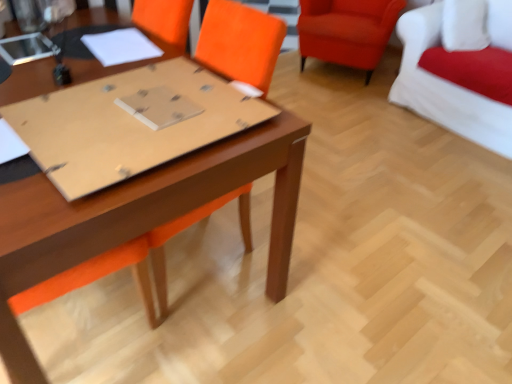
Question: Is matte cardboard at center positioned beyond the bounds of white fabric couch at upper right, placed as the first chair when sorted from right to left?

Choices:
 (A) no
 (B) yes

Answer: (B)

Question: Is matte cardboard at center facing away from white fabric couch at upper right, marked as the second chair in a left-to-right arrangement?

Choices:
 (A) yes
 (B) no

Answer: (A)

Question: Can you confirm if matte cardboard at center is positioned to the right of white fabric couch at upper right, placed as the first chair when sorted from right to left?

Choices:
 (A) yes
 (B) no

Answer: (B)

Question: From a real-world perspective, is matte cardboard at center positioned under white fabric couch at upper right, placed as the first chair when sorted from right to left, based on gravity?

Choices:
 (A) no
 (B) yes

Answer: (A)

Question: Is matte cardboard at center bigger than white fabric couch at upper right, placed as the first chair when sorted from right to left?

Choices:
 (A) yes
 (B) no

Answer: (B)

Question: Based on their positions, is matte brown table at center located to the left or right of white fabric couch at upper right, placed as the first chair when sorted from right to left?

Choices:
 (A) right
 (B) left

Answer: (B)

Question: Is matte brown table at center in front of or behind white fabric couch at upper right, marked as the second chair in a left-to-right arrangement, in the image?

Choices:
 (A) behind
 (B) front

Answer: (B)

Question: From their relative heights in the image, would you say matte brown table at center is taller or shorter than white fabric couch at upper right, marked as the second chair in a left-to-right arrangement?

Choices:
 (A) tall
 (B) short

Answer: (B)

Question: Considering the positions of matte brown table at center and white fabric couch at upper right, placed as the first chair when sorted from right to left, in the image, is matte brown table at center bigger or smaller than white fabric couch at upper right, placed as the first chair when sorted from right to left,?

Choices:
 (A) big
 (B) small

Answer: (A)

Question: Considering the positions of white paper at center and matte brown table at center in the image, is white paper at center taller or shorter than matte brown table at center?

Choices:
 (A) tall
 (B) short

Answer: (B)

Question: Is white paper at center wider or thinner than matte brown table at center?

Choices:
 (A) thin
 (B) wide

Answer: (A)

Question: Is white paper at center to the left or to the right of matte brown table at center in the image?

Choices:
 (A) right
 (B) left

Answer: (A)

Question: From the image's perspective, is white paper at center above or below matte brown table at center?

Choices:
 (A) below
 (B) above

Answer: (B)

Question: Considering the positions of matte cardboard at center and matte brown table at center in the image, is matte cardboard at center taller or shorter than matte brown table at center?

Choices:
 (A) tall
 (B) short

Answer: (B)

Question: From a real-world perspective, is matte cardboard at center positioned above or below matte brown table at center?

Choices:
 (A) above
 (B) below

Answer: (A)